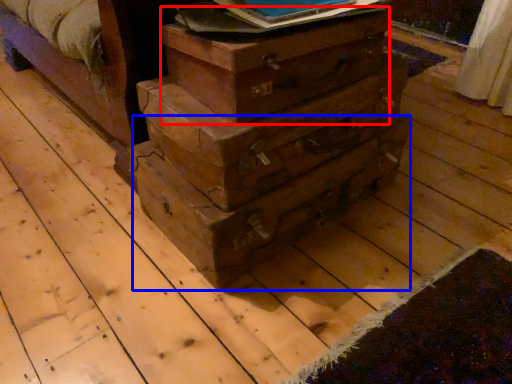
Question: Which object is further to the camera taking this photo, crate (highlighted by a red box) or drawer (highlighted by a blue box)?

Choices:
 (A) crate
 (B) drawer

Answer: (B)